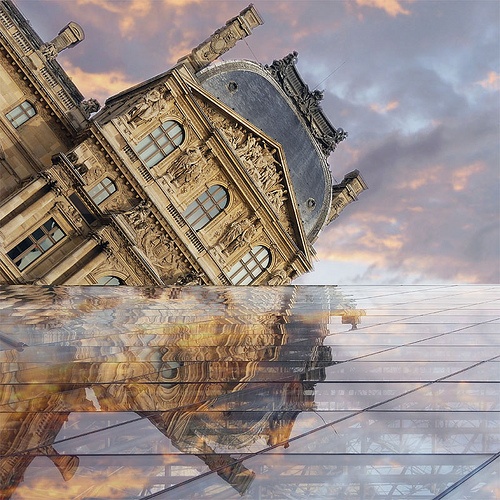
What are the coordinates of `round pillars` in the screenshot? It's located at (87, 270), (72, 261), (24, 216), (21, 199).